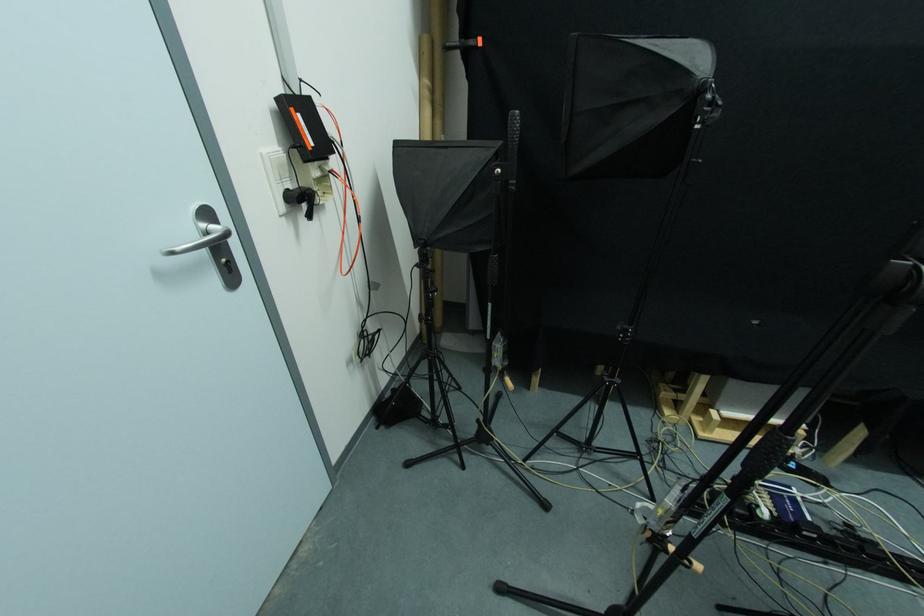
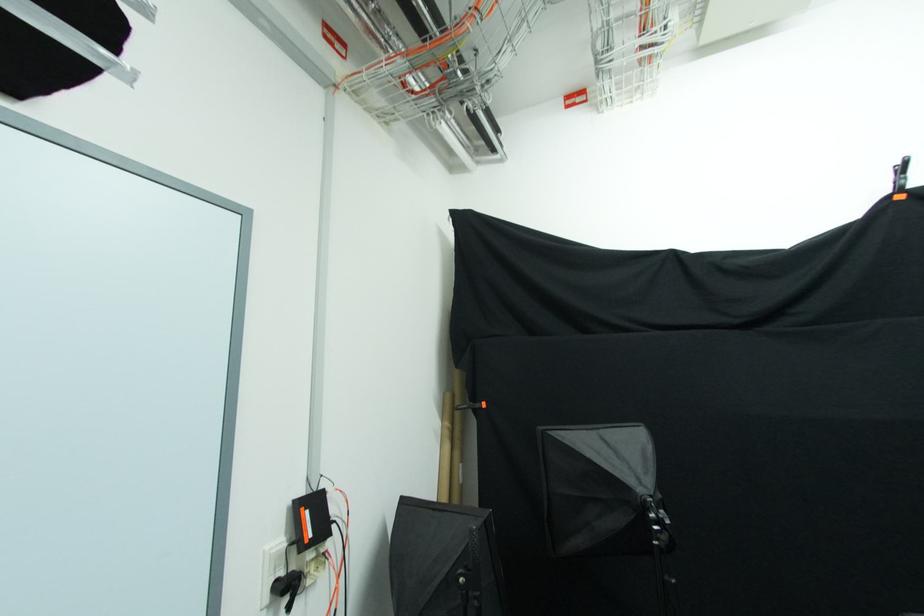
Question: The first image is from the beginning of the video and the second image is from the end. How did the camera likely rotate when shooting the video?

Choices:
 (A) Left
 (B) Right
 (C) Up
 (D) Down

Answer: (C)